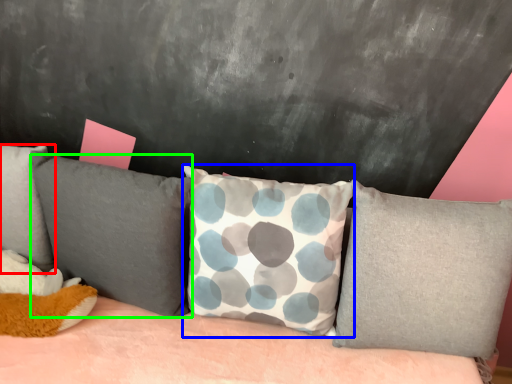
Question: Which is farther away from pillow (highlighted by a red box)? pillow (highlighted by a blue box) or pillow (highlighted by a green box)?

Choices:
 (A) pillow
 (B) pillow

Answer: (A)